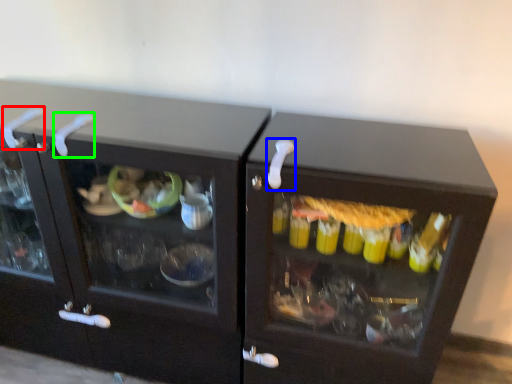
Question: Considering the real-world distances, which object is farthest from door handle (highlighted by a red box)? door handle (highlighted by a blue box) or door handle (highlighted by a green box)?

Choices:
 (A) door handle
 (B) door handle

Answer: (A)